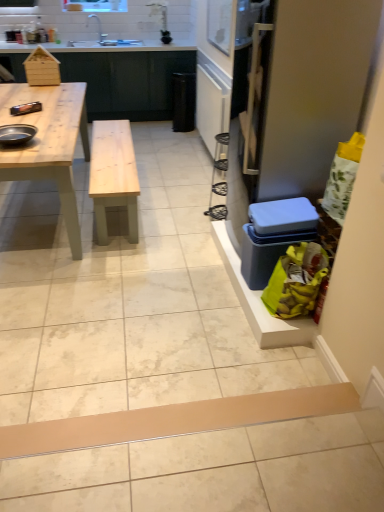
Question: From a real-world perspective, is natural wood table at left above or below brown cardboard plank at lower center?

Choices:
 (A) above
 (B) below

Answer: (A)

Question: From their relative heights in the image, would you say natural wood table at left is taller or shorter than brown cardboard plank at lower center?

Choices:
 (A) short
 (B) tall

Answer: (B)

Question: Based on their relative distances, which object is nearer to the shiny black pan at left?

Choices:
 (A) clear plastic screen door at right
 (B) transparent plastic window screen at upper center
 (C) matte wood counter at upper left
 (D) brown cardboard plank at lower center
 (E) white ceramic sink at upper center

Answer: (A)

Question: Estimate the real-world distances between objects in this image. Which object is closer to the white ceramic sink at upper center?

Choices:
 (A) matte wood counter at upper left
 (B) shiny black pan at left
 (C) brown cardboard plank at lower center
 (D) transparent plastic window screen at upper center
 (E) clear plastic screen door at right

Answer: (A)